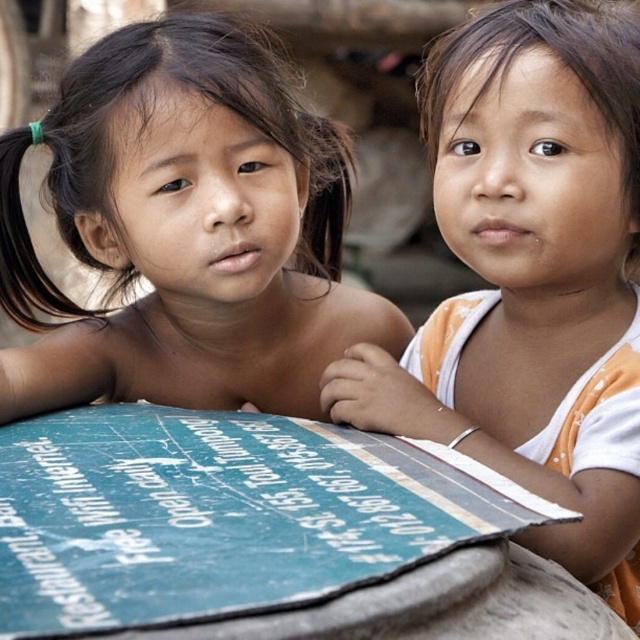
Question: Is smooth skin child at center above matte orange tank top at center?

Choices:
 (A) no
 (B) yes

Answer: (B)

Question: Which point is closer to the camera?

Choices:
 (A) smooth skin child at center
 (B) matte orange tank top at center

Answer: (B)

Question: Which object appears farthest from the camera in this image?

Choices:
 (A) smooth skin child at center
 (B) matte orange tank top at center

Answer: (A)

Question: Does smooth skin child at center have a lesser width compared to matte orange tank top at center?

Choices:
 (A) no
 (B) yes

Answer: (A)

Question: Which of the following is the closest to the observer?

Choices:
 (A) matte orange tank top at center
 (B) smooth skin child at center

Answer: (A)

Question: Does smooth skin child at center have a larger size compared to matte orange tank top at center?

Choices:
 (A) no
 (B) yes

Answer: (B)